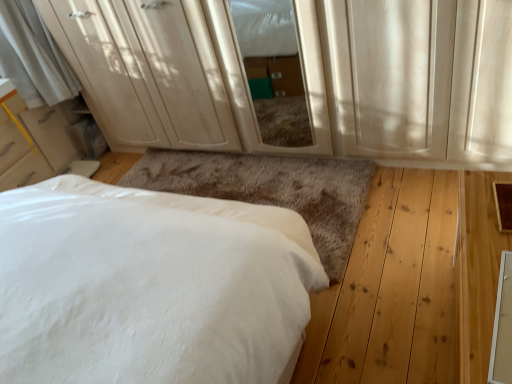
Question: Is matte wood screen door at center behind white soft bed at lower left?

Choices:
 (A) no
 (B) yes

Answer: (B)

Question: Is matte wood screen door at center aimed at white soft bed at lower left?

Choices:
 (A) no
 (B) yes

Answer: (B)

Question: Is matte wood screen door at center completely or partially outside of white soft bed at lower left?

Choices:
 (A) yes
 (B) no

Answer: (A)

Question: Can you confirm if matte wood screen door at center is bigger than white soft bed at lower left?

Choices:
 (A) no
 (B) yes

Answer: (A)

Question: From a real-world perspective, does matte wood screen door at center stand above white soft bed at lower left?

Choices:
 (A) yes
 (B) no

Answer: (A)

Question: Is matte white dresser at upper center wider or thinner than white soft bed at lower left?

Choices:
 (A) thin
 (B) wide

Answer: (A)

Question: Is matte white dresser at upper center taller or shorter than white soft bed at lower left?

Choices:
 (A) short
 (B) tall

Answer: (B)

Question: Considering their positions, is matte white dresser at upper center located in front of or behind white soft bed at lower left?

Choices:
 (A) behind
 (B) front

Answer: (A)

Question: From the image's perspective, is matte white dresser at upper center above or below white soft bed at lower left?

Choices:
 (A) above
 (B) below

Answer: (A)

Question: Would you say matte white dresser at upper center is to the left or to the right of matte wood screen door at center in the picture?

Choices:
 (A) left
 (B) right

Answer: (A)

Question: In the image, is matte white dresser at upper center positioned in front of or behind matte wood screen door at center?

Choices:
 (A) front
 (B) behind

Answer: (B)

Question: Is matte white dresser at upper center taller or shorter than matte wood screen door at center?

Choices:
 (A) short
 (B) tall

Answer: (B)

Question: Considering the positions of point coord(227,130) and point coord(301,26), is point coord(227,130) closer or farther from the camera than point coord(301,26)?

Choices:
 (A) farther
 (B) closer

Answer: (A)

Question: Would you say white soft bed at lower left is inside or outside matte wood screen door at center?

Choices:
 (A) inside
 (B) outside

Answer: (B)

Question: In the image, is white soft bed at lower left on the left side or the right side of matte wood screen door at center?

Choices:
 (A) right
 (B) left

Answer: (B)